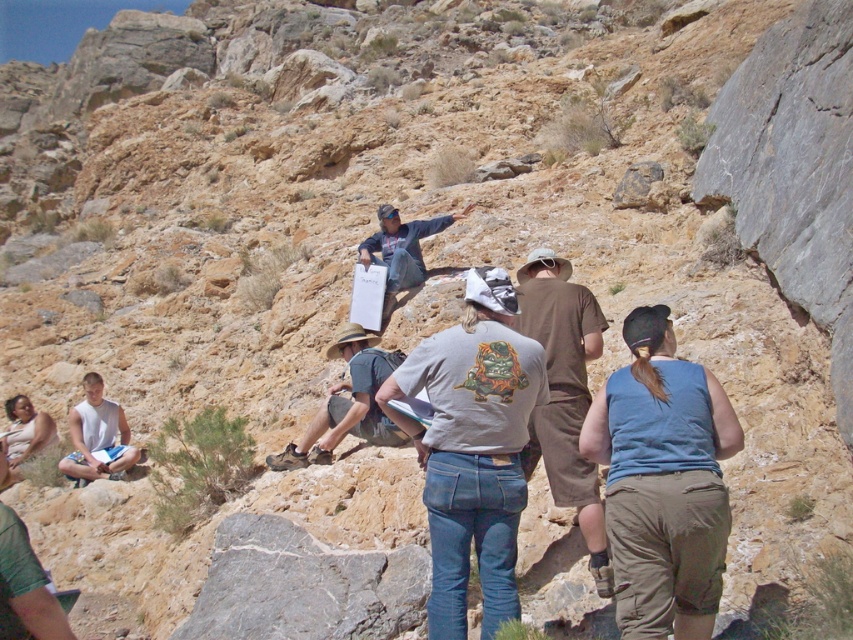
Is brown cotton shirt at center further to camera compared to blue denim jeans at center?

No, it is not.

This screenshot has width=853, height=640. I want to click on brown cotton shirt at center, so click(x=564, y=394).

Image resolution: width=853 pixels, height=640 pixels. What do you see at coordinates (564, 394) in the screenshot?
I see `brown cotton shirt at center` at bounding box center [564, 394].

Where is `brown cotton shirt at center`? brown cotton shirt at center is located at coordinates (564, 394).

Which of these two, camouflage fabric shirt at lower left or blue denim jeans at center, stands shorter?

camouflage fabric shirt at lower left is shorter.

Between camouflage fabric shirt at lower left and blue denim jeans at center, which one is positioned higher?

blue denim jeans at center

You are a GUI agent. You are given a task and a screenshot of the screen. Output one action in this format:
    pyautogui.click(x=<x>, y=<y>)
    Task: Click on the camouflage fabric shirt at lower left
    
    Given the screenshot: What is the action you would take?
    pyautogui.click(x=25, y=588)

Is point (587, 532) farther from viewer compared to point (328, 412)?

No, it is in front of (328, 412).

Is brown cotton shirt at center shorter than gray fabric shirt at center?

No.

Is point (515, 321) farther from camera compared to point (372, 426)?

That is False.

Identify the location of brown cotton shirt at center. (564, 394).